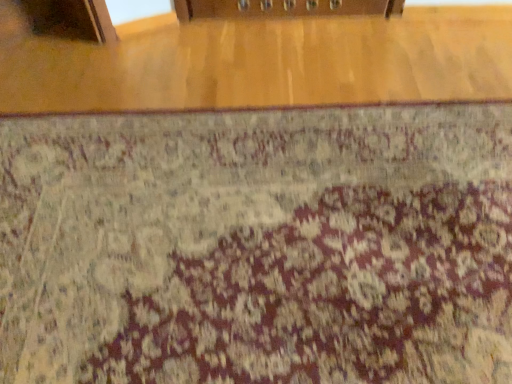
You are a GUI agent. You are given a task and a screenshot of the screen. Output one action in this format:
    pyautogui.click(x=<x>, y=<y>)
    Task: Click on the free spot below floral-patterned carpet at center (from a real-world perspective)
    
    Given the screenshot: What is the action you would take?
    pyautogui.click(x=254, y=228)